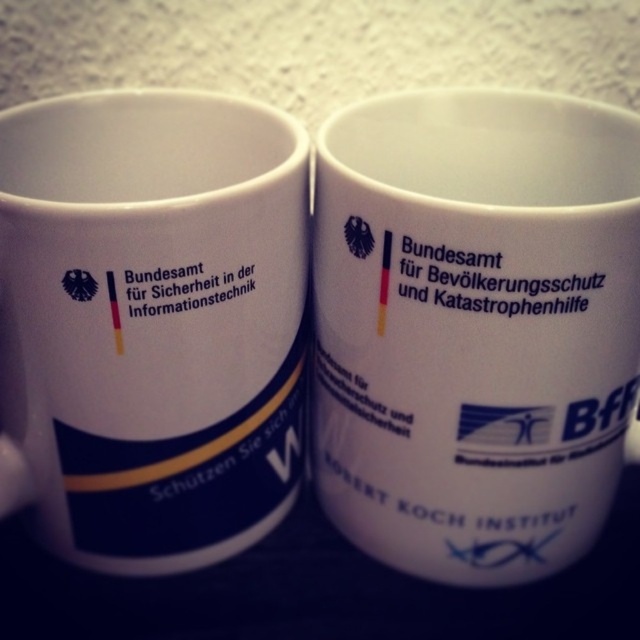
Looking at this image, you are organizing a meeting and need to choose a mug for coffee. You have two options in front of you, the white ceramic mug at center and the white ceramic mug at left. Which one has a bigger capacity?

The white ceramic mug at center is larger in size than the white ceramic mug at left, so it likely has a bigger capacity.

Based on the photo, you are arranging promotional mugs on a shelf. You have a white ceramic mug at center and a white ceramic mug at left. According to the image, which mug is positioned to the right of the other?

The white ceramic mug at center is to the right of the white ceramic mug at left.